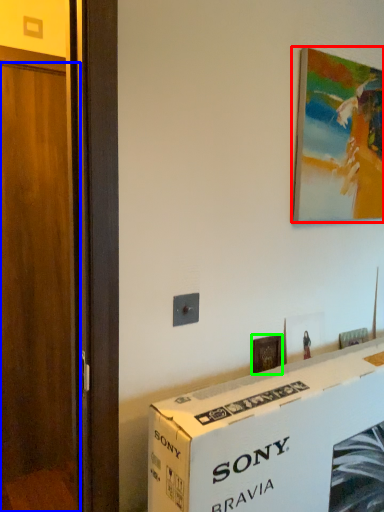
Question: Considering the real-world distances, which object is farthest from picture frame (highlighted by a red box)? door (highlighted by a blue box) or picture frame (highlighted by a green box)?

Choices:
 (A) door
 (B) picture frame

Answer: (A)